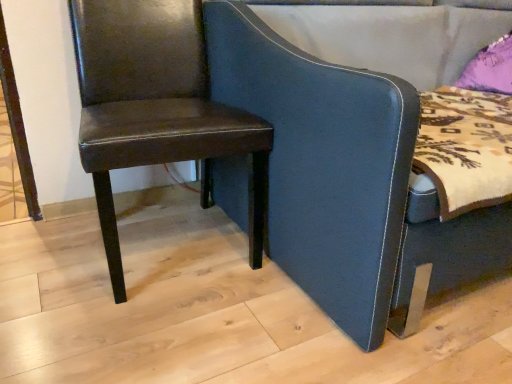
You are a GUI agent. You are given a task and a screenshot of the screen. Output one action in this format:
    pyautogui.click(x=<x>, y=<y>)
    Task: Click on the vacant space underneath matte brown leather chair at left, acting as the 2th chair starting from the right (from a real-world perspective)
    This screenshot has width=512, height=384.
    Given the screenshot: What is the action you would take?
    pyautogui.click(x=172, y=239)